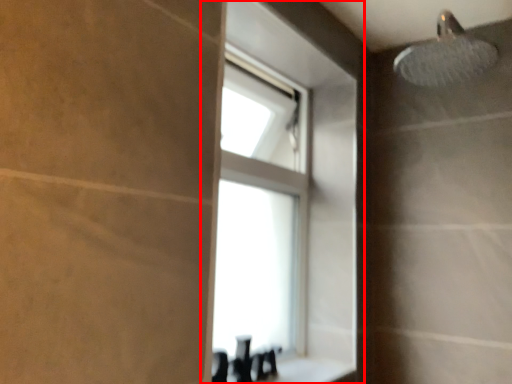
Question: From the image's perspective, where is window (annotated by the red box) located relative to counter top?

Choices:
 (A) below
 (B) above

Answer: (B)